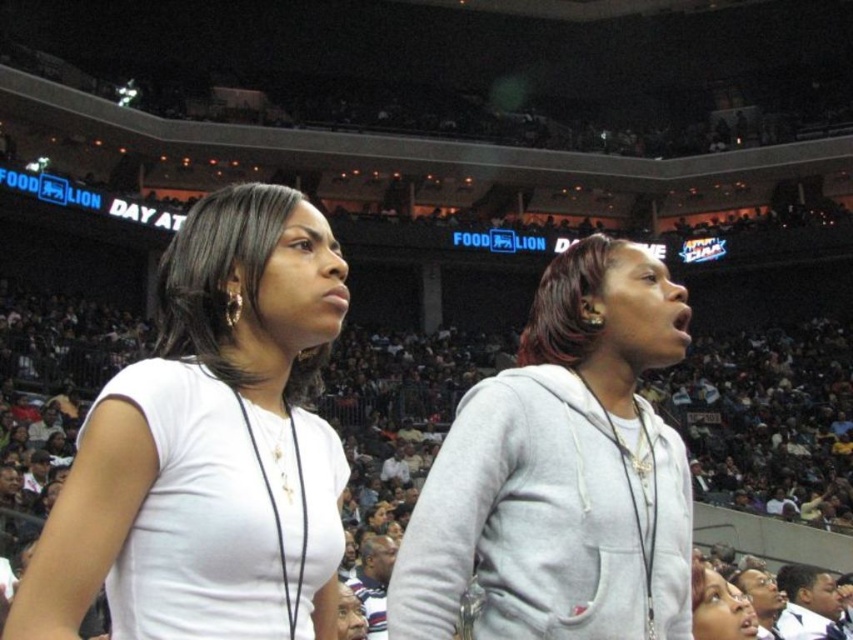
Question: Which point appears farthest from the camera in this image?

Choices:
 (A) (334, 536)
 (B) (618, 275)

Answer: (B)

Question: Can you confirm if white matte shirt at center is positioned to the left of gray hoodie at center?

Choices:
 (A) no
 (B) yes

Answer: (B)

Question: Which point is closer to the camera?

Choices:
 (A) gray hoodie at center
 (B) white matte shirt at center

Answer: (B)

Question: Can you confirm if white matte shirt at center is bigger than gray hoodie at center?

Choices:
 (A) yes
 (B) no

Answer: (A)

Question: Does white matte shirt at center lie in front of gray hoodie at center?

Choices:
 (A) no
 (B) yes

Answer: (B)